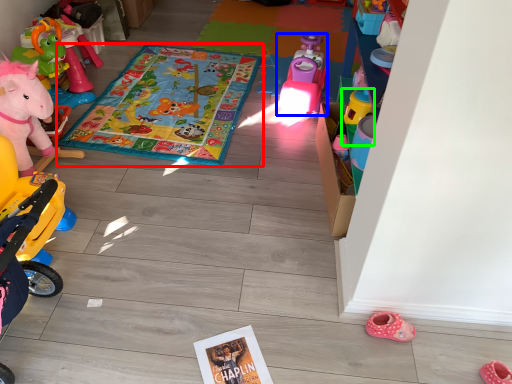
Question: Which object is the farthest from blanket (highlighted by a red box)? Choose among these: toy (highlighted by a blue box) or toy (highlighted by a green box).

Choices:
 (A) toy
 (B) toy

Answer: (B)